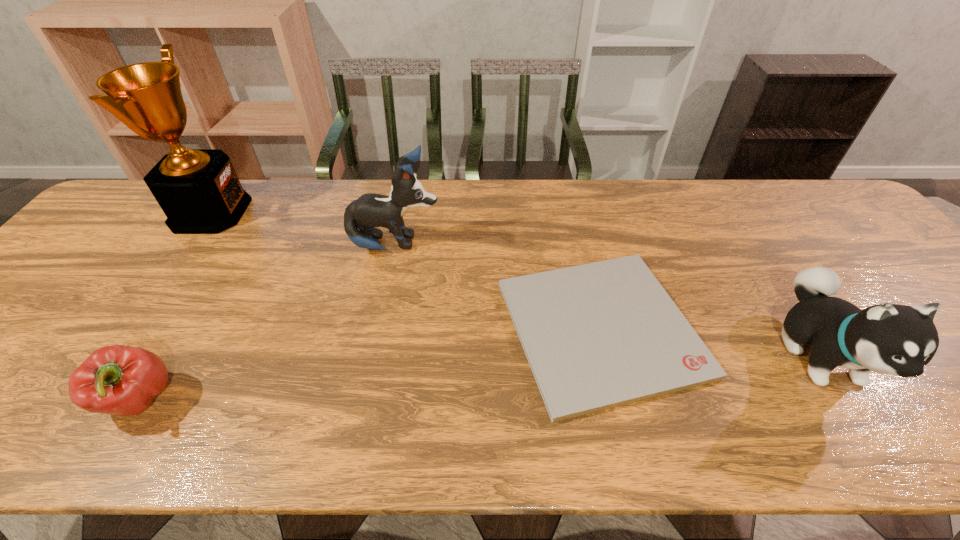
Locate an element on the screen. the tallest object is located at coordinates (198, 190).

Find the location of a particular element. the farther puppy is located at coordinates (370, 210).

Locate an element on the screen. This screenshot has height=540, width=960. the left puppy is located at coordinates (370, 210).

Locate an element on the screen. the right puppy is located at coordinates (891, 339).

Where is `the rightmost object`? The width and height of the screenshot is (960, 540). the rightmost object is located at coordinates (x=891, y=339).

I want to click on bell pepper, so click(x=119, y=380).

Find the location of a particular element. the second object from right to left is located at coordinates (601, 335).

Identify the location of the shortest object. (601, 335).

Locate an element on the screen. Image resolution: width=960 pixels, height=540 pixels. vacant area situated 0.080m on the front of the trophy cup with the label is located at coordinates (272, 212).

You are a GUI agent. You are given a task and a screenshot of the screen. Output one action in this format:
    pyautogui.click(x=<x>, y=<y>)
    Task: Click on the free space located on the front-facing side of the farther puppy
    This screenshot has height=540, width=960.
    Given the screenshot: What is the action you would take?
    tap(565, 245)